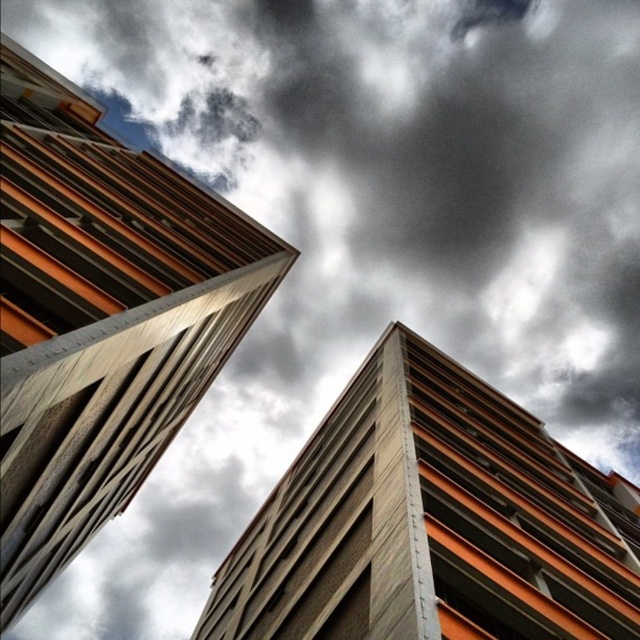
Can you confirm if orange concrete building at left is positioned to the left of orange concrete building at center?

Correct, you'll find orange concrete building at left to the left of orange concrete building at center.

Is the position of orange concrete building at left more distant than that of orange concrete building at center?

Yes, it is.

You are a GUI agent. You are given a task and a screenshot of the screen. Output one action in this format:
    pyautogui.click(x=<x>, y=<y>)
    Task: Click on the orange concrete building at left
    The height and width of the screenshot is (640, 640).
    Given the screenshot: What is the action you would take?
    pyautogui.click(x=100, y=316)

Find the location of `orange concrete building at left`. orange concrete building at left is located at coordinates (100, 316).